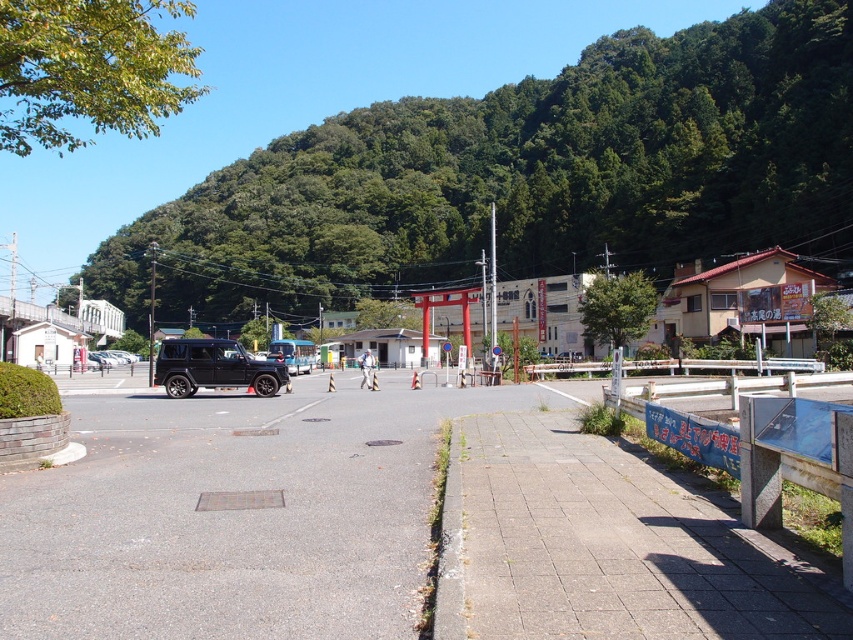
Between point (685, 99) and point (157, 360), which one is positioned behind?

Positioned behind is point (685, 99).

Is green leafy mountain at upper center shorter than matte black suv at center?

Incorrect, green leafy mountain at upper center's height does not fall short of matte black suv at center's.

Describe the element at coordinates (524, 177) in the screenshot. The height and width of the screenshot is (640, 853). I see `green leafy mountain at upper center` at that location.

This screenshot has height=640, width=853. I want to click on green leafy mountain at upper center, so click(x=524, y=177).

Locate an element on the screen. The image size is (853, 640). matte black suv at center is located at coordinates (213, 368).

Between point (276, 388) and point (115, 355), which one is positioned in front?

Point (276, 388) is more forward.

You are a GUI agent. You are given a task and a screenshot of the screen. Output one action in this format:
    pyautogui.click(x=<x>, y=<y>)
    Task: Click on the matte black suv at center
    The height and width of the screenshot is (640, 853).
    Given the screenshot: What is the action you would take?
    pyautogui.click(x=213, y=368)

In the scene shown: Is green leafy mountain at upper center bigger than matte black suv at center-left?

Correct, green leafy mountain at upper center is larger in size than matte black suv at center-left.

Measure the distance between green leafy mountain at upper center and camera.

266.71 feet

Is point (161, 298) positioned behind point (93, 362)?

Yes, point (161, 298) is farther from viewer.

Where is `green leafy mountain at upper center`? green leafy mountain at upper center is located at coordinates (524, 177).